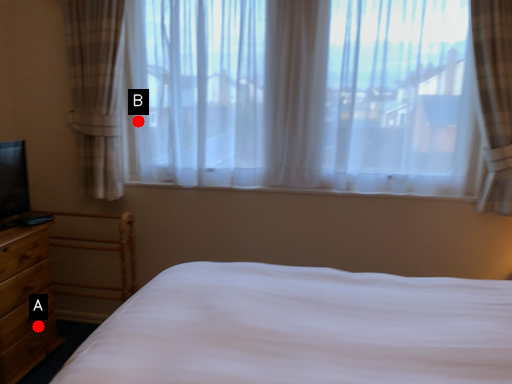
Question: Two points are circled on the image, labeled by A and B beside each circle. Among these points, which one is farthest from the camera?

Choices:
 (A) A is further
 (B) B is further

Answer: (B)